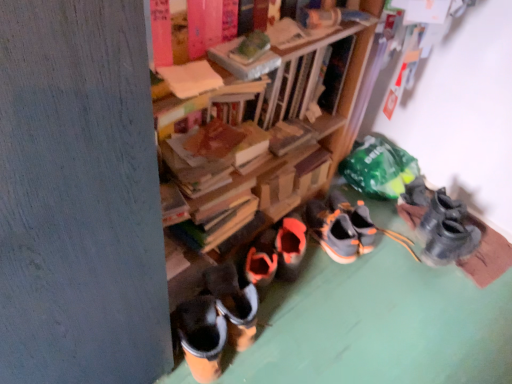
Question: From a real-world perspective, is gray suede sneakers at center, which is the 1th footwear from left to right, under orange suede sneakers at center, positioned as the second footwear in right-to-left order?

Choices:
 (A) yes
 (B) no

Answer: (B)

Question: Does gray suede sneakers at center, which is counted as the 3th footwear, starting from the right, have a lesser width compared to orange suede sneakers at center, the second footwear positioned from the left?

Choices:
 (A) yes
 (B) no

Answer: (B)

Question: Does gray suede sneakers at center, which is counted as the 3th footwear, starting from the right, have a greater width compared to orange suede sneakers at center, the second footwear positioned from the left?

Choices:
 (A) yes
 (B) no

Answer: (A)

Question: Considering the relative sizes of gray suede sneakers at center, which is the 1th footwear from left to right, and orange suede sneakers at center, the second footwear positioned from the left, in the image provided, is gray suede sneakers at center, which is the 1th footwear from left to right, smaller than orange suede sneakers at center, the second footwear positioned from the left,?

Choices:
 (A) yes
 (B) no

Answer: (B)

Question: Is the depth of gray suede sneakers at center, which is counted as the 3th footwear, starting from the right, less than that of orange suede sneakers at center, positioned as the second footwear in right-to-left order?

Choices:
 (A) yes
 (B) no

Answer: (A)

Question: Considering the positions of point (203, 84) and point (477, 235), is point (203, 84) closer or farther from the camera than point (477, 235)?

Choices:
 (A) closer
 (B) farther

Answer: (A)

Question: From a real-world perspective, is matte cardboard book at upper center, placed as the 2th book when sorted from back to front, above or below matte gray sneakers at right, which is the first footwear from right to left?

Choices:
 (A) above
 (B) below

Answer: (A)

Question: Considering the positions of matte cardboard book at upper center, placed as the 2th book when sorted from back to front, and matte gray sneakers at right, which is the first footwear from right to left, in the image, is matte cardboard book at upper center, placed as the 2th book when sorted from back to front, taller or shorter than matte gray sneakers at right, which is the first footwear from right to left,?

Choices:
 (A) short
 (B) tall

Answer: (A)

Question: Looking at their shapes, would you say matte cardboard book at upper center, placed as the 2th book when sorted from back to front, is wider or thinner than matte gray sneakers at right, which is the first footwear from right to left?

Choices:
 (A) wide
 (B) thin

Answer: (B)

Question: In the image, is matte gray sneakers at right, which is the first footwear from right to left, positioned in front of or behind gray suede sneakers at center, which is the 1th footwear from left to right?

Choices:
 (A) front
 (B) behind

Answer: (B)

Question: From a real-world perspective, is matte gray sneakers at right, acting as the third footwear starting from the left, physically located above or below gray suede sneakers at center, which is counted as the 3th footwear, starting from the right?

Choices:
 (A) above
 (B) below

Answer: (A)

Question: Visually, is matte gray sneakers at right, acting as the third footwear starting from the left, positioned to the left or to the right of gray suede sneakers at center, which is the 1th footwear from left to right?

Choices:
 (A) left
 (B) right

Answer: (B)

Question: From their relative heights in the image, would you say matte gray sneakers at right, which is the first footwear from right to left, is taller or shorter than gray suede sneakers at center, which is the 1th footwear from left to right?

Choices:
 (A) tall
 (B) short

Answer: (A)

Question: Is point (404, 268) closer or farther from the camera than point (239, 168)?

Choices:
 (A) closer
 (B) farther

Answer: (B)

Question: In the image, is orange rubber boots at lower left positioned in front of or behind wooden book at center, marked as the first book in a back-to-front arrangement?

Choices:
 (A) behind
 (B) front

Answer: (B)